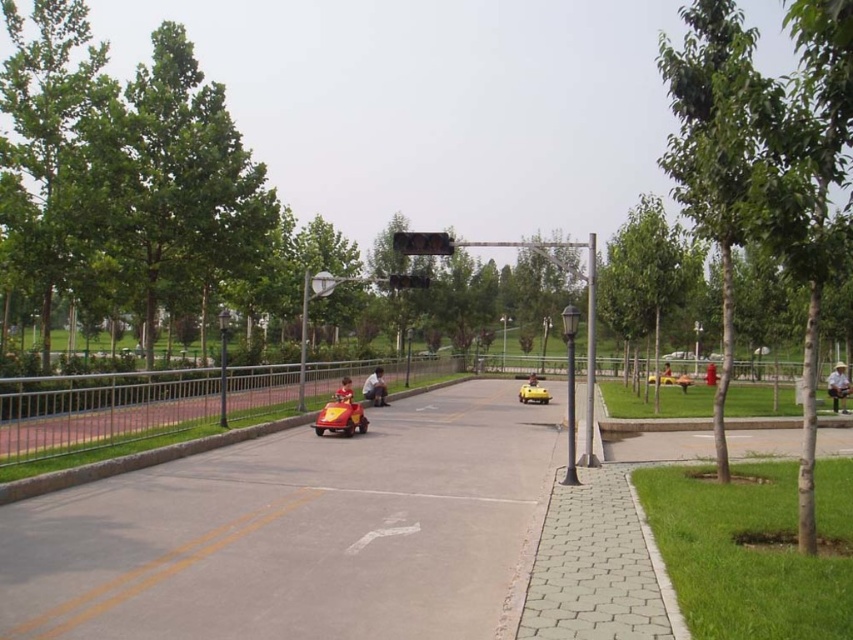
Does smooth concrete road at center appear on the right side of yellow fabric child at center?

Incorrect, smooth concrete road at center is not on the right side of yellow fabric child at center.

Which is above, smooth concrete road at center or yellow fabric child at center?

yellow fabric child at center

Is point (485, 426) farther from viewer compared to point (668, 380)?

That is False.

Image resolution: width=853 pixels, height=640 pixels. I want to click on smooth concrete road at center, so click(x=300, y=532).

Who is positioned more to the right, yellow matte toy car at center or matte red go-kart at center?

yellow matte toy car at center is more to the right.

Can you confirm if yellow matte toy car at center is positioned to the left of matte red go-kart at center?

Incorrect, yellow matte toy car at center is not on the left side of matte red go-kart at center.

Does point (531, 392) lie in front of point (340, 401)?

No, it is not.

At what (x,y) coordinates should I click in order to perform the action: click on yellow matte toy car at center. Please return your answer as a coordinate pair (x, y). Looking at the image, I should click on (532, 392).

Can you confirm if smooth concrete road at center is wider than matte red go-kart at center?

Indeed, smooth concrete road at center has a greater width compared to matte red go-kart at center.

Between smooth concrete road at center and matte red go-kart at center, which one has less height?

Standing shorter between the two is matte red go-kart at center.

Image resolution: width=853 pixels, height=640 pixels. Identify the location of smooth concrete road at center. (300, 532).